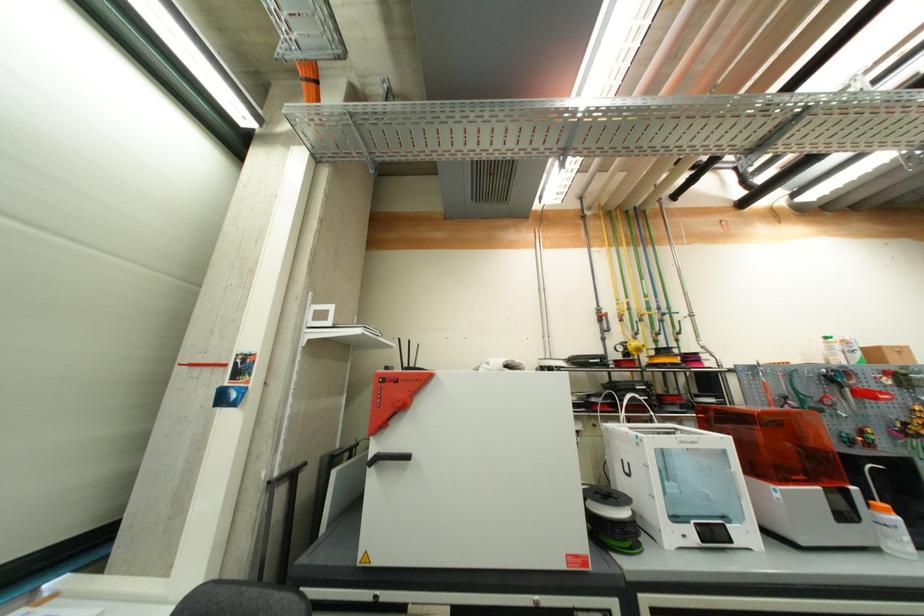
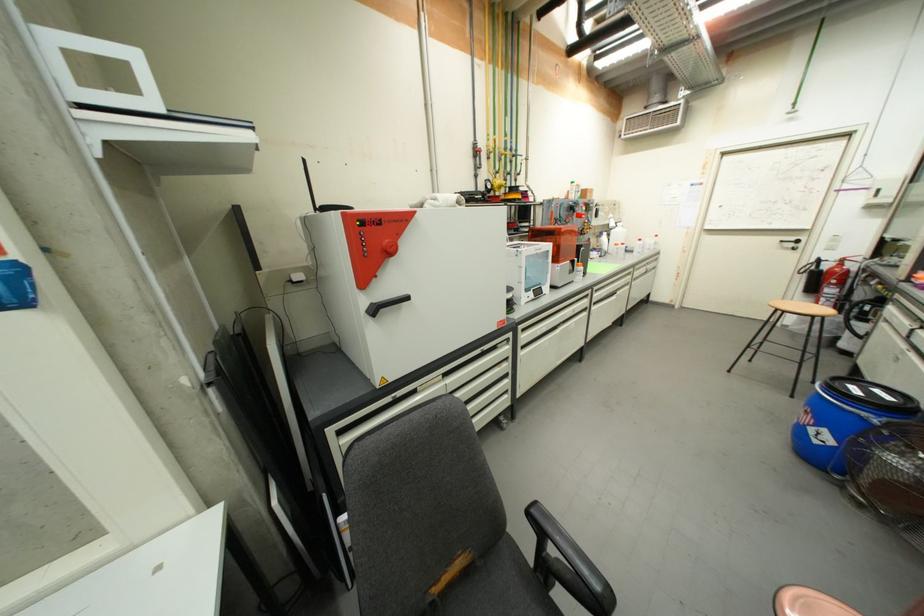
The first image is from the beginning of the video and the second image is from the end. How did the camera likely rotate when shooting the video?

The rotation direction of the camera is right-down.